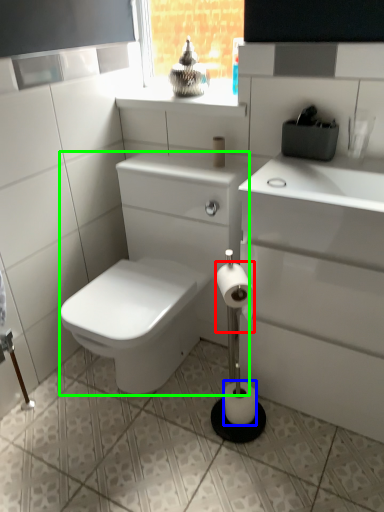
Question: Estimate the real-world distances between objects in this image. Which object is closer to toilet paper (highlighted by a red box), toilet paper (highlighted by a blue box) or porcelain (highlighted by a green box)?

Choices:
 (A) toilet paper
 (B) porcelain

Answer: (A)